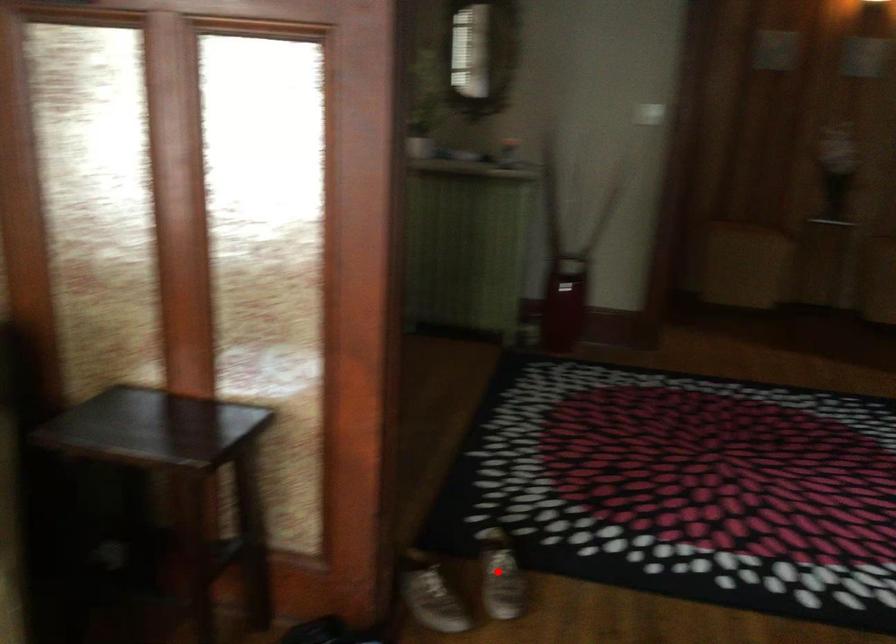
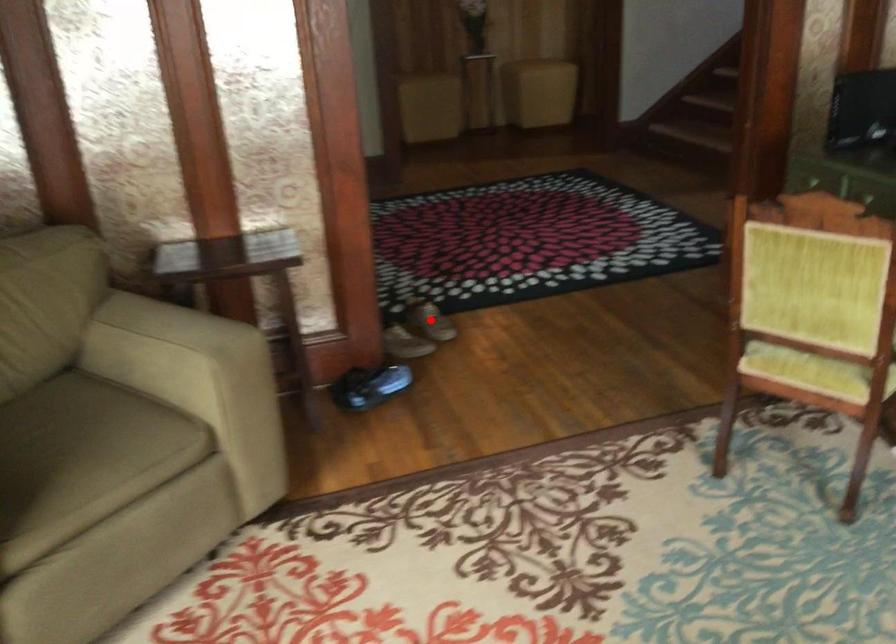
I am providing you with two images of the same scene from different viewpoints. A red point is marked on the first image and another point is marked on the second image. Is the red point in image1 aligned with the point shown in image2?

Yes